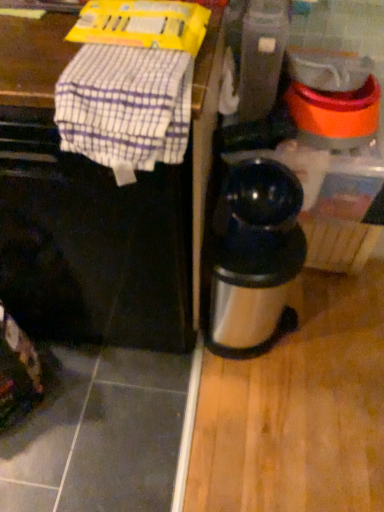
Question: Should I look upward or downward to see white checkered cloth at upper left?

Choices:
 (A) down
 (B) up

Answer: (B)

Question: Is stainless steel thermos at right shorter than white checkered cloth at upper left?

Choices:
 (A) yes
 (B) no

Answer: (B)

Question: From a real-world perspective, is stainless steel thermos at right located beneath white checkered cloth at upper left?

Choices:
 (A) yes
 (B) no

Answer: (A)

Question: Considering the relative sizes of stainless steel thermos at right and white checkered cloth at upper left in the image provided, is stainless steel thermos at right thinner than white checkered cloth at upper left?

Choices:
 (A) no
 (B) yes

Answer: (A)

Question: From the image's perspective, would you say stainless steel thermos at right is positioned over white checkered cloth at upper left?

Choices:
 (A) yes
 (B) no

Answer: (B)

Question: Does stainless steel thermos at right lie in front of white checkered cloth at upper left?

Choices:
 (A) yes
 (B) no

Answer: (B)

Question: Considering the relative positions of stainless steel thermos at right and white checkered cloth at upper left in the image provided, is stainless steel thermos at right to the left of white checkered cloth at upper left from the viewer's perspective?

Choices:
 (A) yes
 (B) no

Answer: (B)

Question: Can you confirm if stainless steel thermos at right is thinner than black matte coffee maker at center?

Choices:
 (A) no
 (B) yes

Answer: (B)

Question: Does stainless steel thermos at right contain black matte coffee maker at center?

Choices:
 (A) no
 (B) yes

Answer: (A)

Question: Does stainless steel thermos at right appear on the right side of black matte coffee maker at center?

Choices:
 (A) no
 (B) yes

Answer: (B)

Question: From a real-world perspective, is stainless steel thermos at right positioned under black matte coffee maker at center based on gravity?

Choices:
 (A) no
 (B) yes

Answer: (B)

Question: From a real-world perspective, is stainless steel thermos at right over black matte coffee maker at center?

Choices:
 (A) yes
 (B) no

Answer: (B)

Question: Is stainless steel thermos at right wider than black matte coffee maker at center?

Choices:
 (A) no
 (B) yes

Answer: (A)

Question: Is stainless steel thermos at right touching metallic gray blender at center?

Choices:
 (A) yes
 (B) no

Answer: (B)